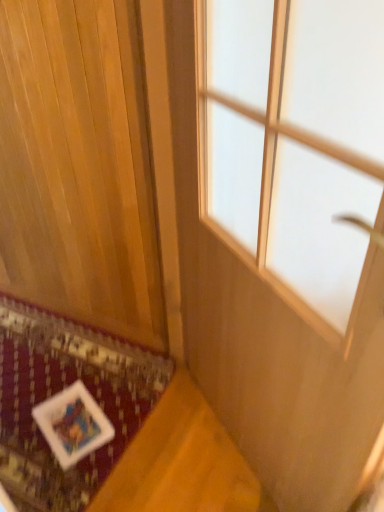
Question: Can you confirm if wooden panel at lower left is wider than transparent glass window at center?

Choices:
 (A) yes
 (B) no

Answer: (B)

Question: From a real-world perspective, does wooden panel at lower left sit lower than transparent glass window at center?

Choices:
 (A) yes
 (B) no

Answer: (B)

Question: Is wooden panel at lower left surrounding transparent glass window at center?

Choices:
 (A) yes
 (B) no

Answer: (B)

Question: Is wooden panel at lower left completely or partially outside of transparent glass window at center?

Choices:
 (A) no
 (B) yes

Answer: (B)

Question: Does wooden panel at lower left have a lesser width compared to transparent glass window at center?

Choices:
 (A) no
 (B) yes

Answer: (B)

Question: Is wooden panel at lower left positioned behind transparent glass window at center?

Choices:
 (A) no
 (B) yes

Answer: (B)

Question: Does transparent glass window at center appear on the right side of white fabric mat at lower left?

Choices:
 (A) yes
 (B) no

Answer: (A)

Question: From a real-world perspective, is transparent glass window at center positioned over white fabric mat at lower left based on gravity?

Choices:
 (A) yes
 (B) no

Answer: (A)

Question: Is transparent glass window at center not near white fabric mat at lower left?

Choices:
 (A) no
 (B) yes

Answer: (B)

Question: Is transparent glass window at center closer to the viewer compared to white fabric mat at lower left?

Choices:
 (A) no
 (B) yes

Answer: (B)

Question: Is white fabric mat at lower left surrounded by transparent glass window at center?

Choices:
 (A) no
 (B) yes

Answer: (A)

Question: Is transparent glass window at center facing towards white fabric mat at lower left?

Choices:
 (A) no
 (B) yes

Answer: (B)

Question: Considering the relative sizes of wooden panel at lower left and white fabric mat at lower left in the image provided, is wooden panel at lower left wider than white fabric mat at lower left?

Choices:
 (A) no
 (B) yes

Answer: (A)